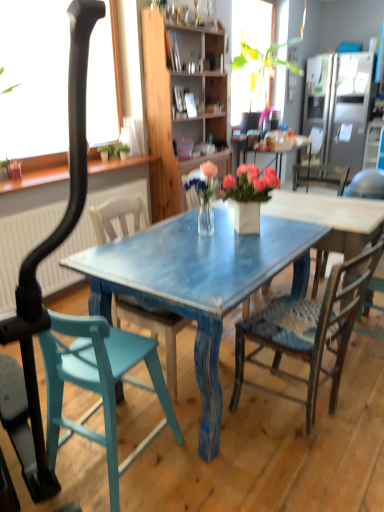
Question: Considering the positions of satin silver refrigerator at upper right and teal painted wood chair at lower left, positioned as the 4th chair in right-to-left order, in the image, is satin silver refrigerator at upper right bigger or smaller than teal painted wood chair at lower left, positioned as the 4th chair in right-to-left order,?

Choices:
 (A) big
 (B) small

Answer: (A)

Question: Considering their positions, is satin silver refrigerator at upper right located in front of or behind teal painted wood chair at lower left, positioned as the 4th chair in right-to-left order?

Choices:
 (A) front
 (B) behind

Answer: (B)

Question: Which object is positioned farthest from the teal painted wood chair at lower left, positioned as the 4th chair in right-to-left order?

Choices:
 (A) wooden chair with woven seat at center, arranged as the 2th chair when viewed from the right
 (B) wooden cabinet at center
 (C) satin silver refrigerator at upper right
 (D) wooden chair at right, placed as the 4th chair when sorted from left to right
 (E) teal wood chair at center, the 2th chair viewed from the left

Answer: (C)

Question: Which object is positioned closest to the wooden cabinet at center?

Choices:
 (A) teal painted wood chair at lower left, positioned as the 4th chair in right-to-left order
 (B) teal wood chair at center, which appears as the 3th chair when viewed from the right
 (C) wooden chair at right, placed as the 4th chair when sorted from left to right
 (D) wooden chair with woven seat at center, arranged as the 2th chair when viewed from the right
 (E) satin silver refrigerator at upper right

Answer: (E)